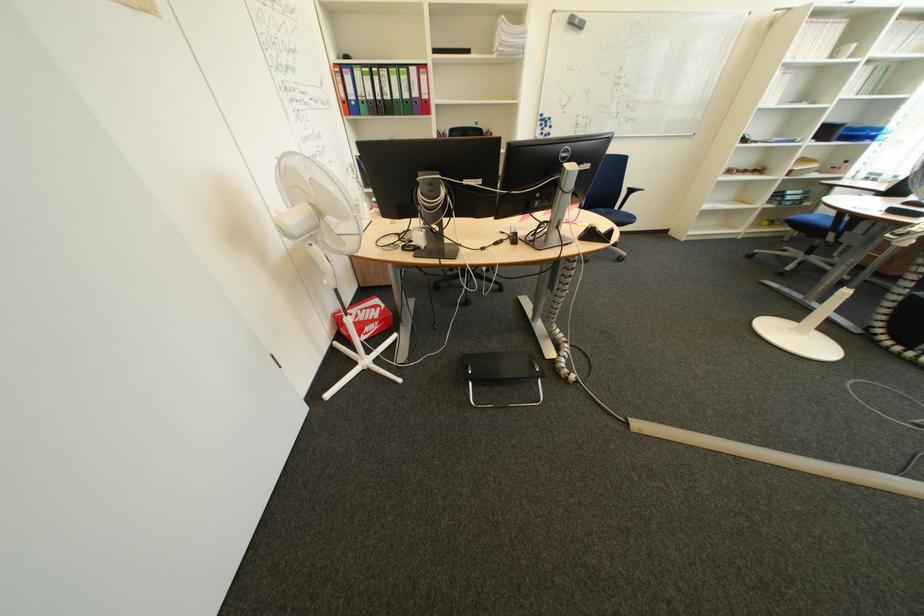
Image resolution: width=924 pixels, height=616 pixels. What do you see at coordinates (502, 371) in the screenshot? I see `the black binder finger hole` at bounding box center [502, 371].